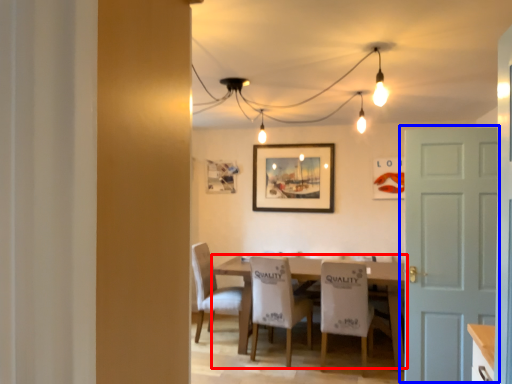
Question: Which of the following is the closest to the observer, table (highlighted by a red box) or door (highlighted by a blue box)?

Choices:
 (A) table
 (B) door

Answer: (B)